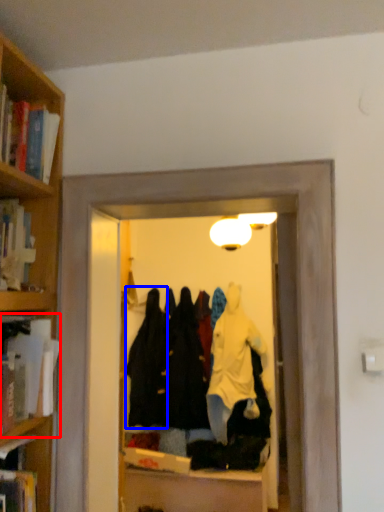
Question: Which object appears closest to the camera in this image, book (highlighted by a red box) or clothing (highlighted by a blue box)?

Choices:
 (A) book
 (B) clothing

Answer: (A)